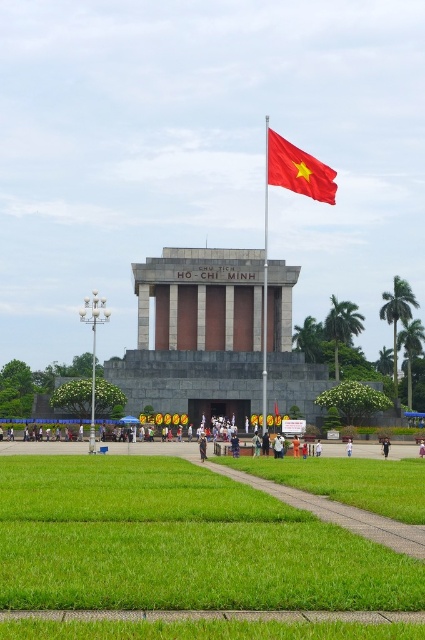
Question: Which of the following is the closest to the observer?

Choices:
 (A) (265, 211)
 (B) (28, 461)

Answer: (B)

Question: Which of these objects is positioned closest to the black uniform at center?

Choices:
 (A) smooth metal flag pole at upper center
 (B) white cotton shirt at center

Answer: (B)

Question: Is black fabric person at center to the right of white cotton shirt at center from the viewer's perspective?

Choices:
 (A) no
 (B) yes

Answer: (A)

Question: Can you confirm if red fabric flag at upper center is positioned above black fabric person at center?

Choices:
 (A) yes
 (B) no

Answer: (A)

Question: Does green grass at center come in front of smooth metal flag pole at upper center?

Choices:
 (A) no
 (B) yes

Answer: (B)

Question: Which point is closer to the camera taking this photo?

Choices:
 (A) (346, 444)
 (B) (265, 429)

Answer: (A)